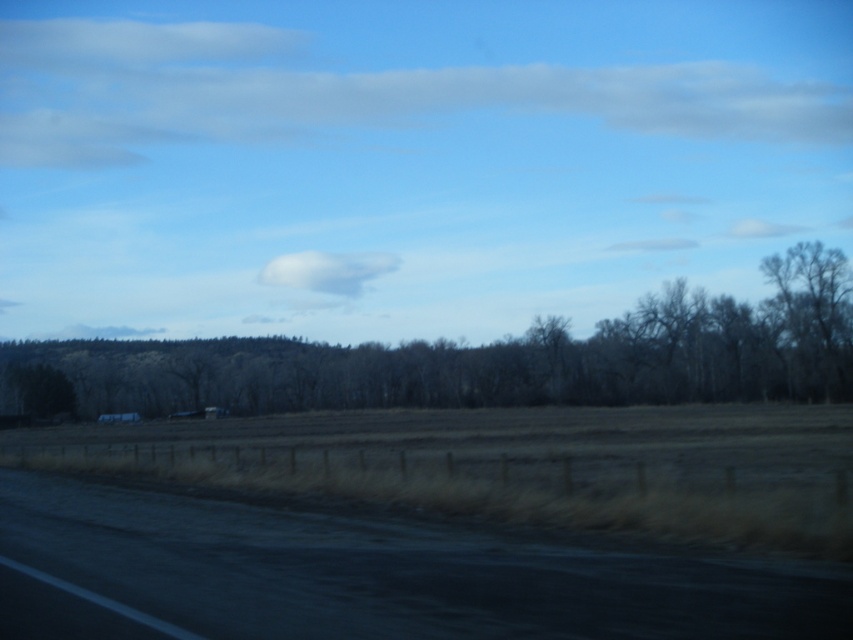
Question: Does white fluffy cloud at upper center have a larger size compared to white fluffy cloud at center?

Choices:
 (A) no
 (B) yes

Answer: (B)

Question: Which point is farther to the camera?

Choices:
 (A) white fluffy cloud at center
 (B) black asphalt road at lower left

Answer: (A)

Question: Which point is farther from the camera taking this photo?

Choices:
 (A) (363, 88)
 (B) (299, 266)
 (C) (4, 364)
 (D) (74, 529)

Answer: (A)

Question: Is white fluffy cloud at upper center thinner than white fluffy cloud at center?

Choices:
 (A) yes
 (B) no

Answer: (B)

Question: Does brown/dry grass at center appear on the left side of white fluffy cloud at center?

Choices:
 (A) no
 (B) yes

Answer: (B)

Question: Which point is closer to the camera taking this photo?

Choices:
 (A) (364, 529)
 (B) (495, 380)
 (C) (706, 67)
 (D) (323, 269)

Answer: (A)